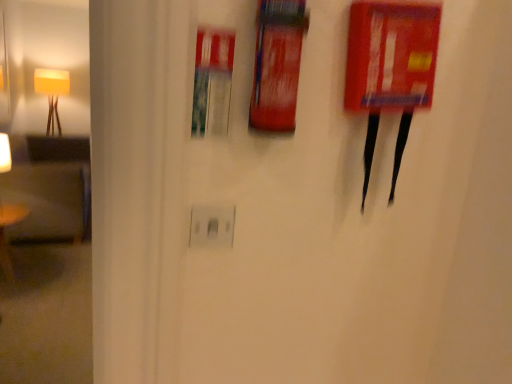
Question: Is white plastic electric outlet at center to the left or to the right of yellow fabric lampshade at left in the image?

Choices:
 (A) left
 (B) right

Answer: (B)

Question: From a real-world perspective, is white plastic electric outlet at center physically located above or below yellow fabric lampshade at left?

Choices:
 (A) below
 (B) above

Answer: (B)

Question: Which is farther from the yellow fabric lampshade at left?

Choices:
 (A) wooden armchair at left
 (B) white plastic electric outlet at center
 (C) red matte fire extinguisher at upper center
 (D) red plastic fire extinguisher at upper right
 (E) wooden table at left

Answer: (C)

Question: Estimate the real-world distances between objects in this image. Which object is closer to the red plastic fire extinguisher at upper right?

Choices:
 (A) wooden armchair at left
 (B) wooden table at left
 (C) yellow fabric lampshade at left
 (D) white plastic electric outlet at center
 (E) red matte fire extinguisher at upper center

Answer: (E)